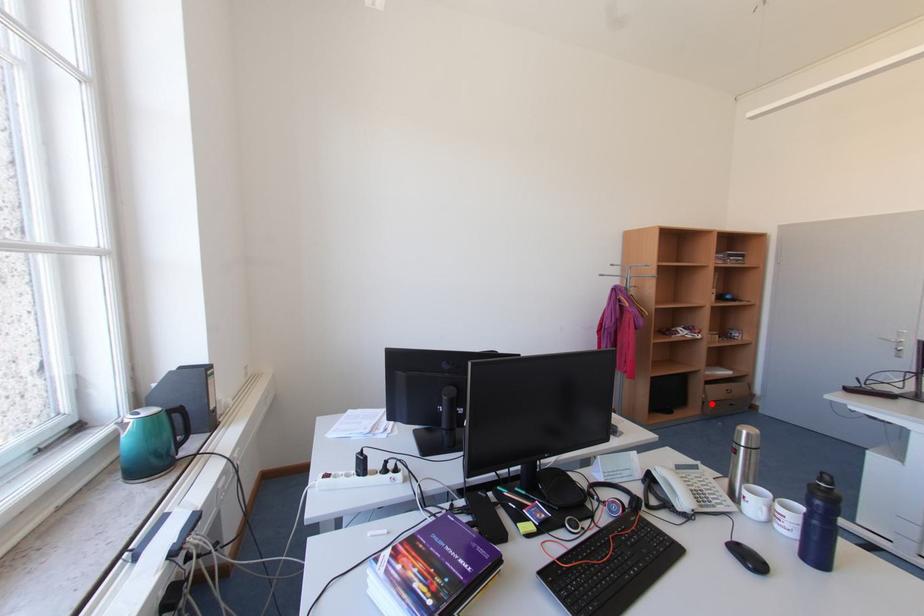
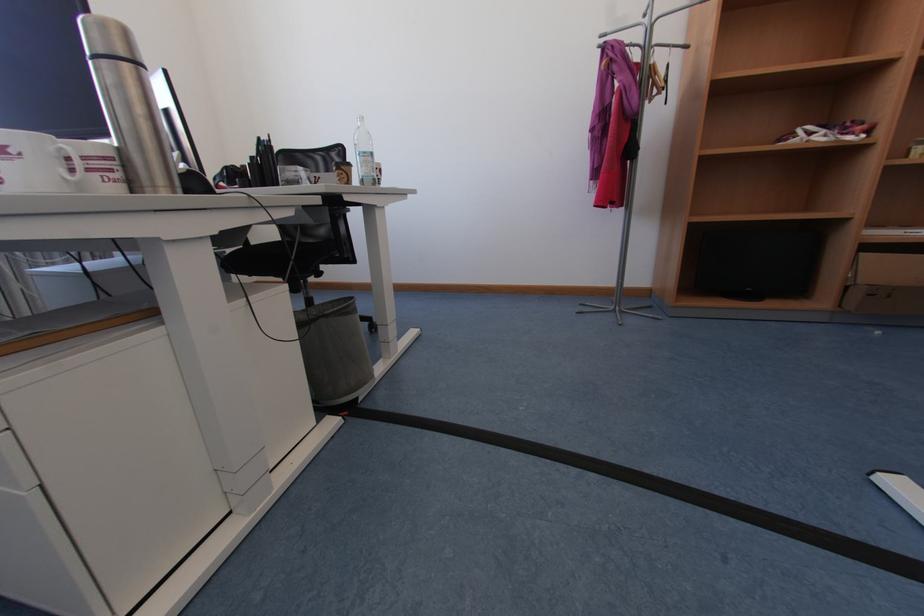
Find the pixel in the second image that matches the highlighted location in the first image.

(855, 289)